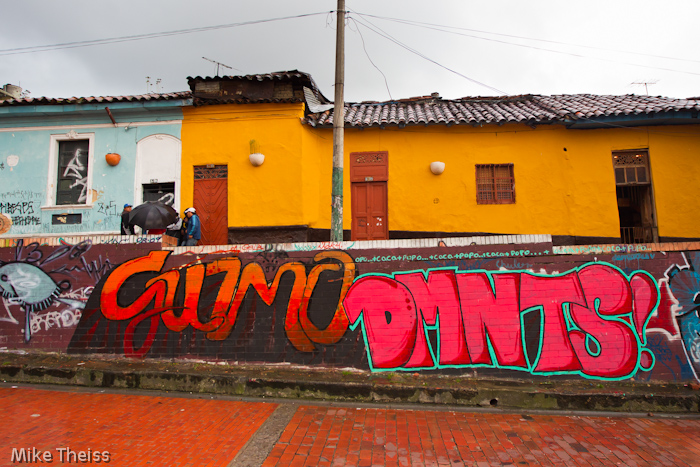
Locate an element on the screen. door is located at coordinates (218, 194), (368, 200), (162, 187), (637, 210).